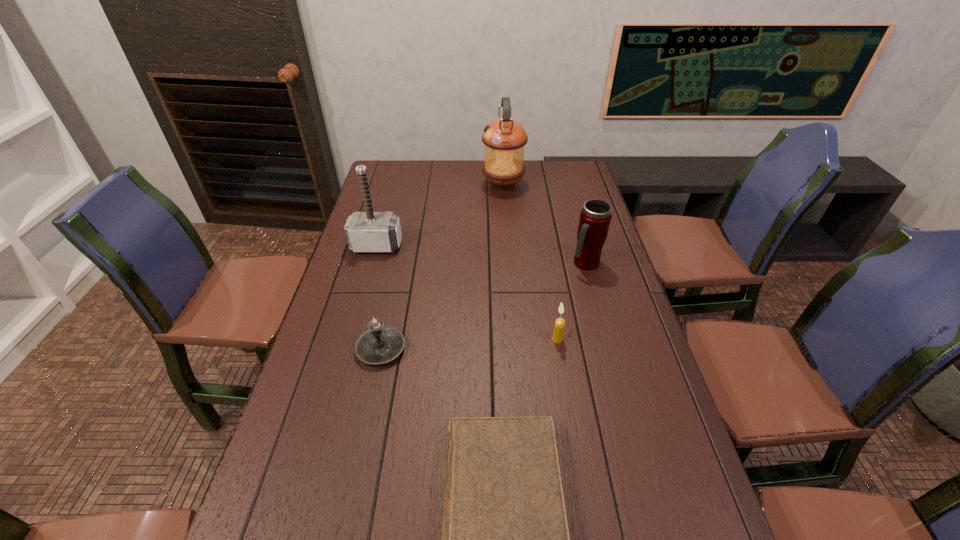
Where is `empty space between the second shortest object and the fourth shortest object`? The image size is (960, 540). empty space between the second shortest object and the fourth shortest object is located at coordinates (483, 306).

Identify the location of unoccupied position between the third tallest object and the right candle. (571, 301).

I want to click on free area in between the third tallest object and the right candle, so click(x=571, y=301).

The height and width of the screenshot is (540, 960). In order to click on blank region between the left candle and the right candle in this screenshot , I will do `click(469, 344)`.

The height and width of the screenshot is (540, 960). I want to click on free spot between the thermos bottle and the oil lamp, so click(x=544, y=224).

Find the location of a particular element. free point between the fifth shortest object and the farthest object is located at coordinates (440, 215).

The image size is (960, 540). Identify the location of vacant point located between the shorter candle and the thermos bottle. (483, 306).

Locate which object is the fourth closest to the third tallest object. Please provide its 2D coordinates. Your answer should be formatted as a tuple, i.e. [(x, y)], where the tuple contains the x and y coordinates of a point satisfying the conditions above.

[(380, 344)]

Where is `the fifth closest object to the second tallest object`? The width and height of the screenshot is (960, 540). the fifth closest object to the second tallest object is located at coordinates (505, 539).

Locate an element on the screen. vacant space that satisfies the following two spatial constraints: 1. for striking with the head of the fifth shortest object; 2. on the left side of the left candle is located at coordinates pyautogui.click(x=348, y=349).